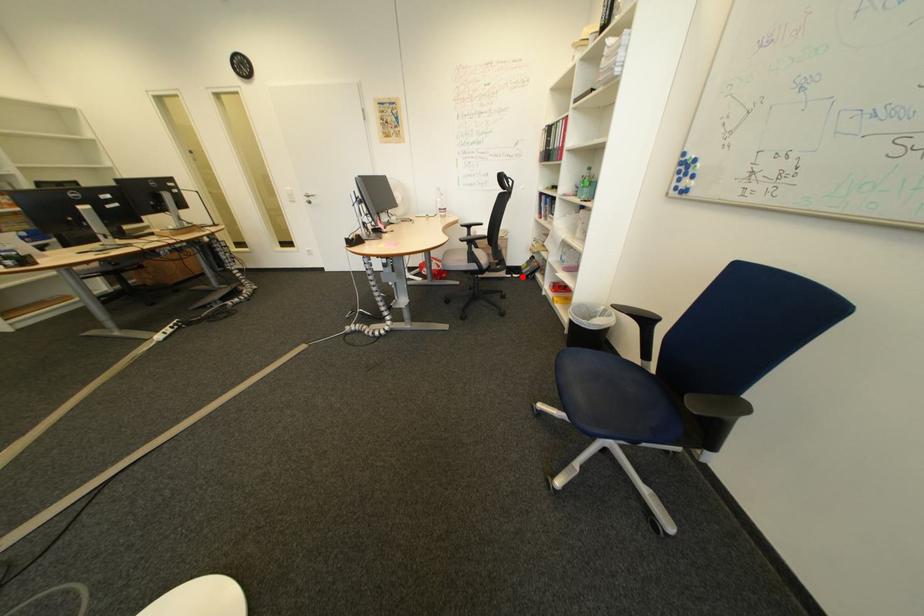
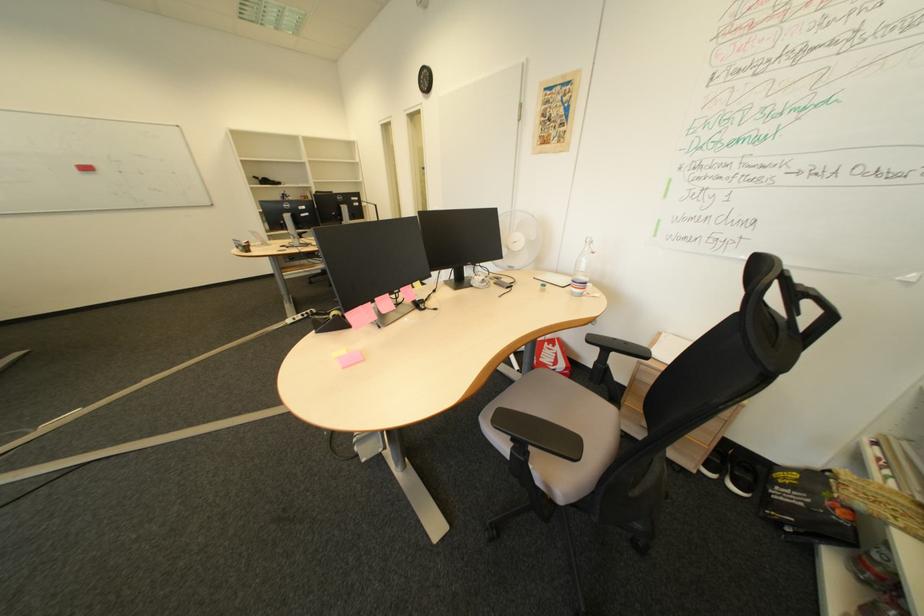
Question: A red point is marked in image1. In image2, is the corresponding 3D point closer to the camera or farther? Reply with the corresponding letter.

Choices:
 (A) The corresponding 3D point is closer.
 (B) The corresponding 3D point is farther.

Answer: (B)